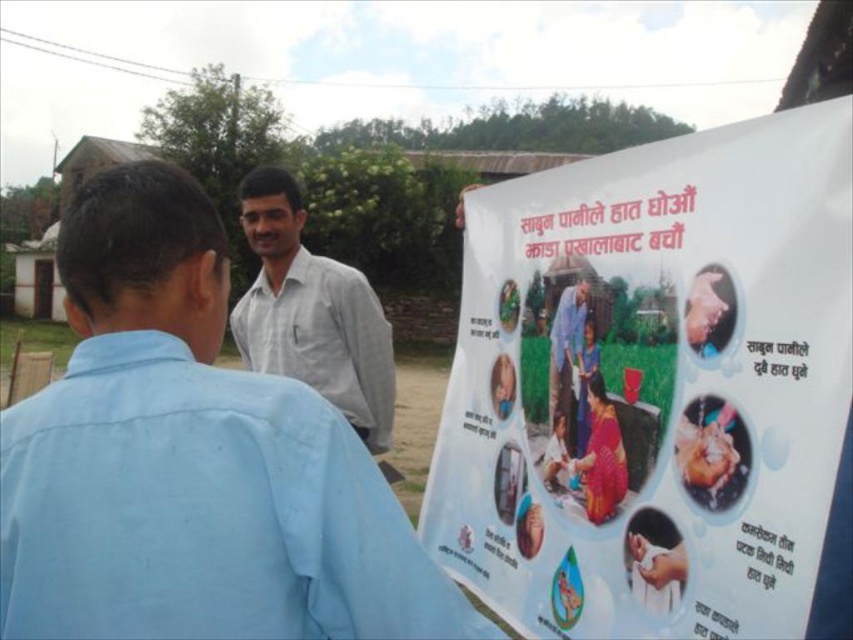
Question: Which object is positioned farthest from the white cotton shirt at upper center?

Choices:
 (A) white paper poster at upper right
 (B) smooth skin hand at center
 (C) gray checkered shirt at center
 (D) blue fabric shirt at center

Answer: (C)

Question: Where is white cotton shirt at upper center located in relation to smooth skin hand at center in the image?

Choices:
 (A) above
 (B) below

Answer: (B)

Question: Is gray checkered shirt at center smaller than blue fabric shirt at center?

Choices:
 (A) yes
 (B) no

Answer: (B)

Question: Which of the following is the closest to the observer?

Choices:
 (A) (569, 301)
 (B) (358, 586)
 (C) (525, 253)
 (D) (299, 362)

Answer: (B)

Question: Which point is closer to the camera?

Choices:
 (A) (117, 365)
 (B) (347, 333)
 (C) (724, 332)
 (D) (552, 321)

Answer: (A)

Question: Is white cotton shirt at upper center below gray checkered shirt at center?

Choices:
 (A) yes
 (B) no

Answer: (A)